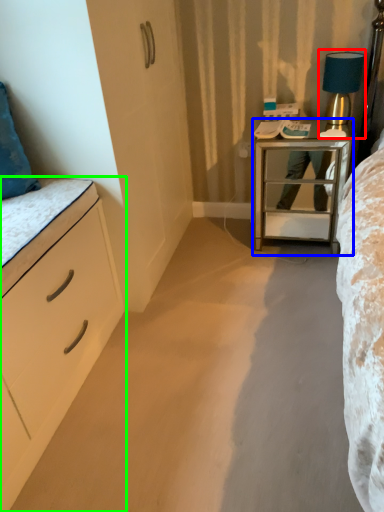
Question: Based on their relative distances, which object is nearer to bedside lamp (highlighted by a red box)? Choose from nightstand (highlighted by a blue box) and chest of drawers (highlighted by a green box).

Choices:
 (A) nightstand
 (B) chest of drawers

Answer: (A)